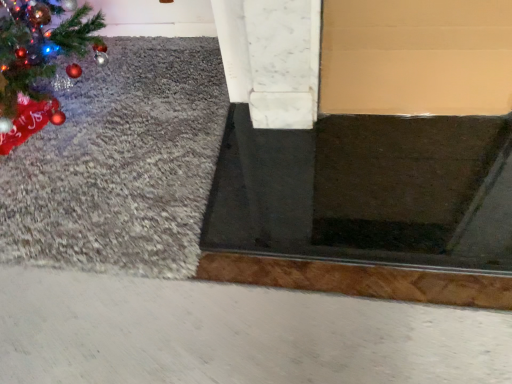
You are a GUI agent. You are given a task and a screenshot of the screen. Output one action in this format:
    pyautogui.click(x=<x>, y=<y>)
    Task: Click on the black rubber doormat at center
    Image resolution: width=512 pixels, height=384 pixels.
    Given the screenshot: What is the action you would take?
    pyautogui.click(x=367, y=191)

What do you see at coordinates (367, 191) in the screenshot?
I see `black rubber doormat at center` at bounding box center [367, 191].

The width and height of the screenshot is (512, 384). Describe the element at coordinates (121, 164) in the screenshot. I see `gray shag rug at left` at that location.

Find the location of `gray shag rug at left`. gray shag rug at left is located at coordinates (121, 164).

Where is `black rubber doormat at center`? This screenshot has width=512, height=384. black rubber doormat at center is located at coordinates (367, 191).

Can you confirm if gray shag rug at left is positioned to the right of black rubber doormat at center?

No.

Is gray shag rug at left behind black rubber doormat at center?

Yes, gray shag rug at left is behind black rubber doormat at center.

Is point (84, 261) behind point (394, 173)?

That is False.

From the picture: From the image's perspective, is gray shag rug at left located above black rubber doormat at center?

Yes.

From a real-world perspective, who is located lower, gray shag rug at left or black rubber doormat at center?

gray shag rug at left.

Considering the relative sizes of gray shag rug at left and black rubber doormat at center in the image provided, is gray shag rug at left thinner than black rubber doormat at center?

In fact, gray shag rug at left might be wider than black rubber doormat at center.

Based on the photo, considering the sizes of objects gray shag rug at left and black rubber doormat at center in the image provided, who is shorter, gray shag rug at left or black rubber doormat at center?

gray shag rug at left.

Does gray shag rug at left have a smaller size compared to black rubber doormat at center?

No, gray shag rug at left is not smaller than black rubber doormat at center.

Is black rubber doormat at center completely or partially inside gray shag rug at left?

No, black rubber doormat at center is not surrounded by gray shag rug at left.

Is gray shag rug at left positioned far away from black rubber doormat at center?

No, gray shag rug at left is not far away from black rubber doormat at center.

Is gray shag rug at left facing away from black rubber doormat at center?

No, gray shag rug at left is not facing the opposite direction of black rubber doormat at center.

The width and height of the screenshot is (512, 384). In order to click on gravel that is under the black rubber doormat at center (from a real-world perspective) in this screenshot , I will do `click(121, 164)`.

Is black rubber doormat at center to the left or to the right of gray shag rug at left in the image?

black rubber doormat at center is positioned on gray shag rug at left's right side.

In the image, is black rubber doormat at center positioned in front of or behind gray shag rug at left?

black rubber doormat at center is in front of gray shag rug at left.

Does point (219, 187) lie in front of point (173, 123)?

That is True.

From the image's perspective, is black rubber doormat at center under gray shag rug at left?

Yes, from the image's perspective, black rubber doormat at center is beneath gray shag rug at left.

From a real-world perspective, is black rubber doormat at center above or below gray shag rug at left?

black rubber doormat at center is above gray shag rug at left.

Is black rubber doormat at center wider or thinner than gray shag rug at left?

Considering their sizes, black rubber doormat at center looks slimmer than gray shag rug at left.

Considering the sizes of black rubber doormat at center and gray shag rug at left in the image, is black rubber doormat at center taller or shorter than gray shag rug at left?

Considering their sizes, black rubber doormat at center has more height than gray shag rug at left.

Is black rubber doormat at center bigger or smaller than gray shag rug at left?

Considering their sizes, black rubber doormat at center takes up less space than gray shag rug at left.

Is black rubber doormat at center completely or partially outside of gray shag rug at left?

Yes, black rubber doormat at center is located beyond the bounds of gray shag rug at left.

Is black rubber doormat at center not close to gray shag rug at left?

No, there isn't a large distance between black rubber doormat at center and gray shag rug at left.

Is black rubber doormat at center aimed at gray shag rug at left?

No, black rubber doormat at center is not aimed at gray shag rug at left.

In the scene shown: Can you tell me how much black rubber doormat at center and gray shag rug at left differ in facing direction?

90.2 degrees separate the facing orientations of black rubber doormat at center and gray shag rug at left.

This screenshot has width=512, height=384. Identify the location of gravel below the black rubber doormat at center (from a real-world perspective). (121, 164).

The image size is (512, 384). I want to click on gravel above the black rubber doormat at center (from the image's perspective), so coord(121,164).

The height and width of the screenshot is (384, 512). Identify the location of doormat that appears below the gray shag rug at left (from the image's perspective). (367, 191).